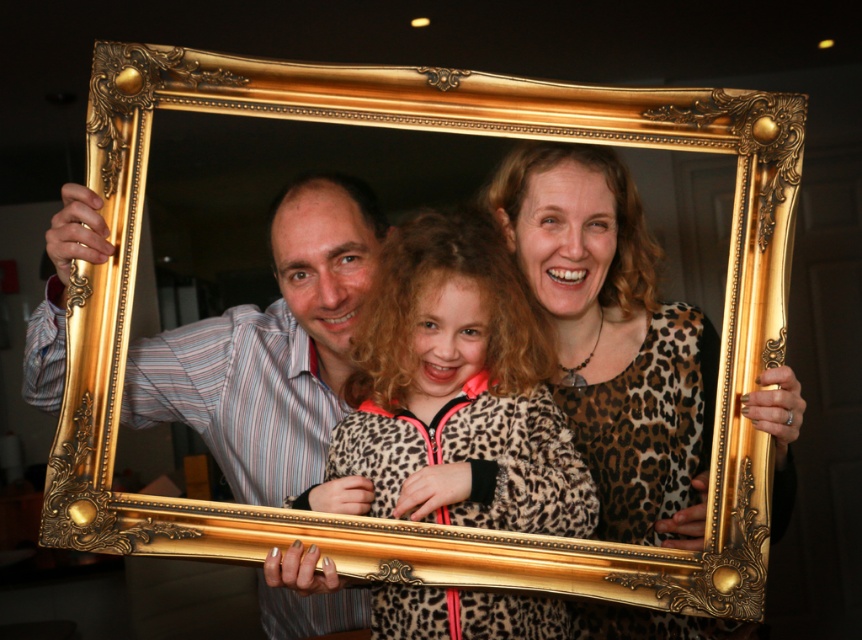
Is leopard print coat at center to the left of leopard print shirt at center from the viewer's perspective?

Correct, you'll find leopard print coat at center to the left of leopard print shirt at center.

Can you confirm if leopard print coat at center is positioned to the right of leopard print shirt at center?

In fact, leopard print coat at center is to the left of leopard print shirt at center.

What are the coordinates of `leopard print coat at center` in the screenshot? It's located at (459, 388).

Identify the location of leopard print coat at center. The image size is (862, 640). (459, 388).

Describe the element at coordinates (459, 388) in the screenshot. I see `leopard print coat at center` at that location.

I want to click on leopard print coat at center, so click(x=459, y=388).

Is point (619, 378) more distant than point (161, 360)?

No.

Between leopard print shirt at center and striped shirt at left, which one appears on the left side from the viewer's perspective?

striped shirt at left

You are a GUI agent. You are given a task and a screenshot of the screen. Output one action in this format:
    pyautogui.click(x=<x>, y=<y>)
    Task: Click on the leopard print shirt at center
    This screenshot has height=640, width=862.
    Given the screenshot: What is the action you would take?
    click(x=614, y=339)

The height and width of the screenshot is (640, 862). I want to click on leopard print shirt at center, so click(614, 339).